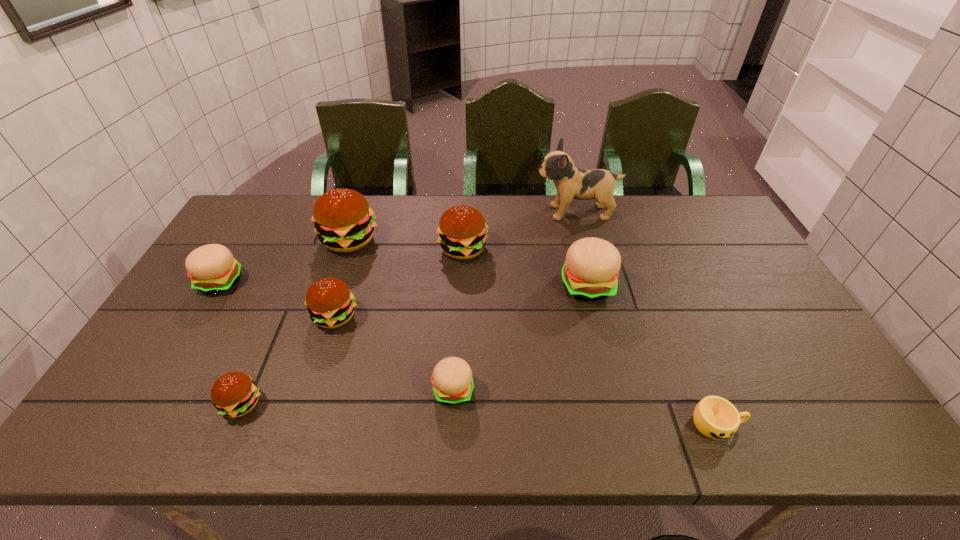
Find the location of a particular element. vacant space that satisfies the following two spatial constraints: 1. on the front side of the rightmost brown hamburger; 2. on the right side of the biggest brown hamburger is located at coordinates (346, 249).

This screenshot has width=960, height=540. In order to click on vacant position in the image that satisfies the following two spatial constraints: 1. on the front side of the shortest object; 2. on the right side of the third biggest brown hamburger in this screenshot , I will do `click(300, 424)`.